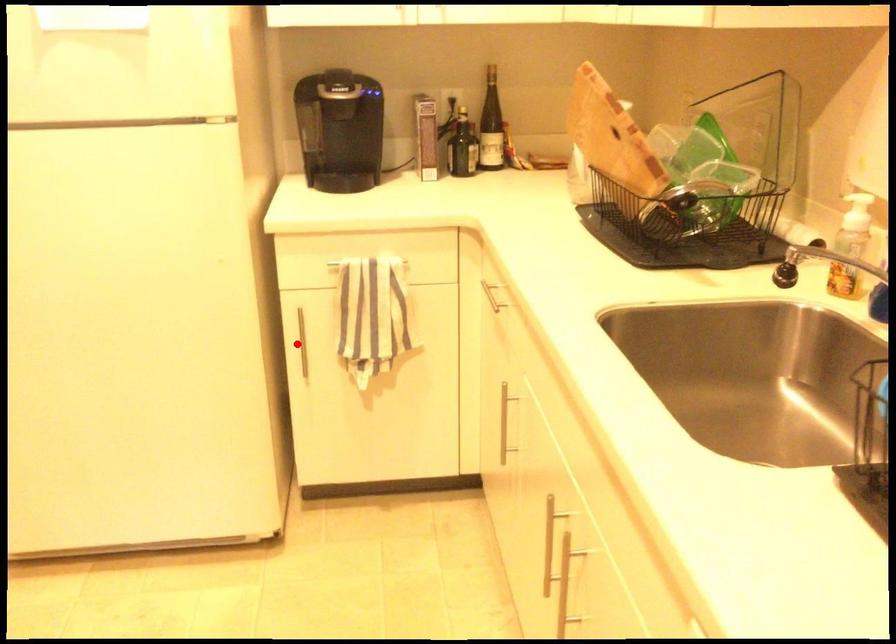
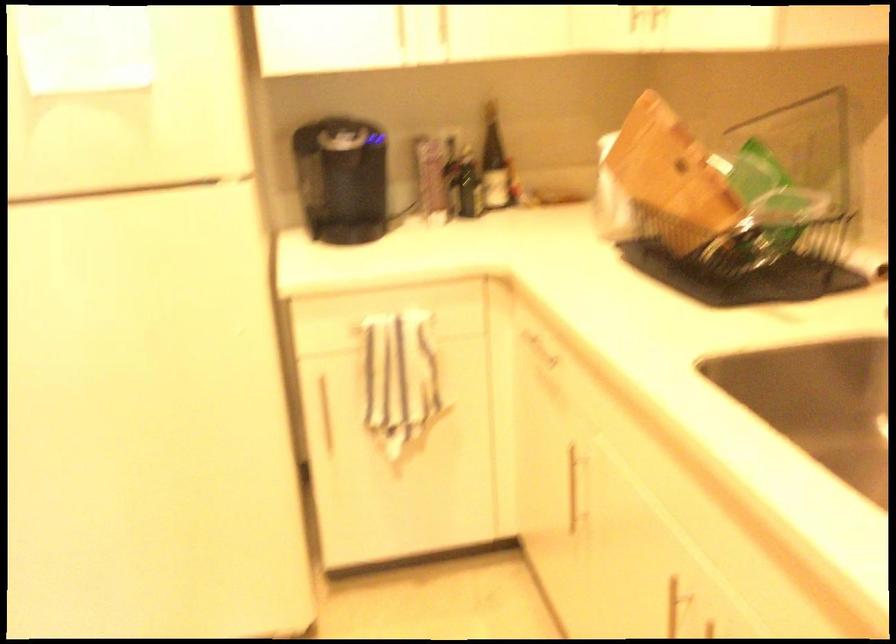
In the second image, find the point that corresponds to the highlighted location in the first image.

(323, 412)